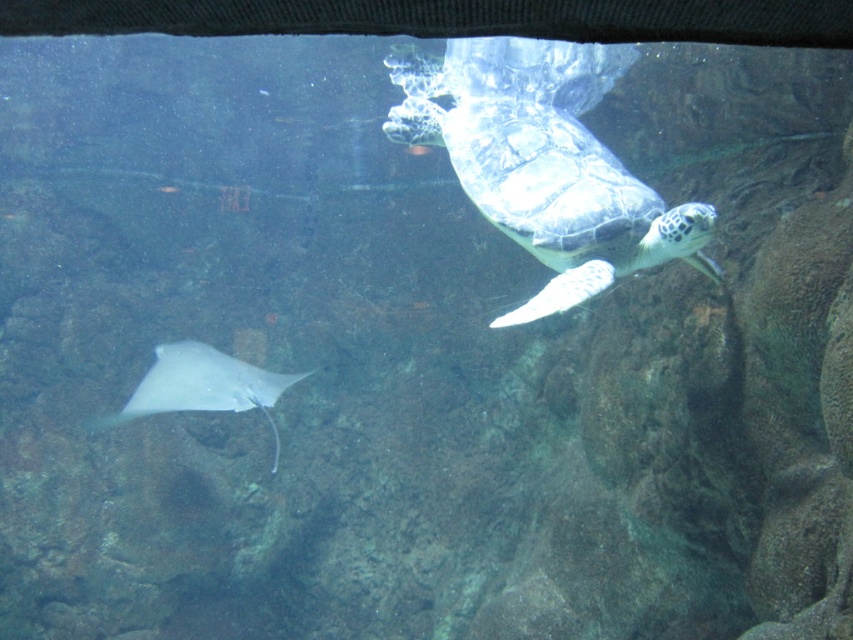
Question: Which object appears closest to the camera in this image?

Choices:
 (A) smooth green turtle at upper center
 (B) white glossy stingray at lower left

Answer: (A)

Question: Is smooth green turtle at upper center bigger than white glossy stingray at lower left?

Choices:
 (A) yes
 (B) no

Answer: (A)

Question: Does smooth green turtle at upper center have a larger size compared to white glossy stingray at lower left?

Choices:
 (A) no
 (B) yes

Answer: (B)

Question: Is smooth green turtle at upper center above white glossy stingray at lower left?

Choices:
 (A) no
 (B) yes

Answer: (B)

Question: Which of the following is the closest to the observer?

Choices:
 (A) (540, 252)
 (B) (129, 404)

Answer: (A)